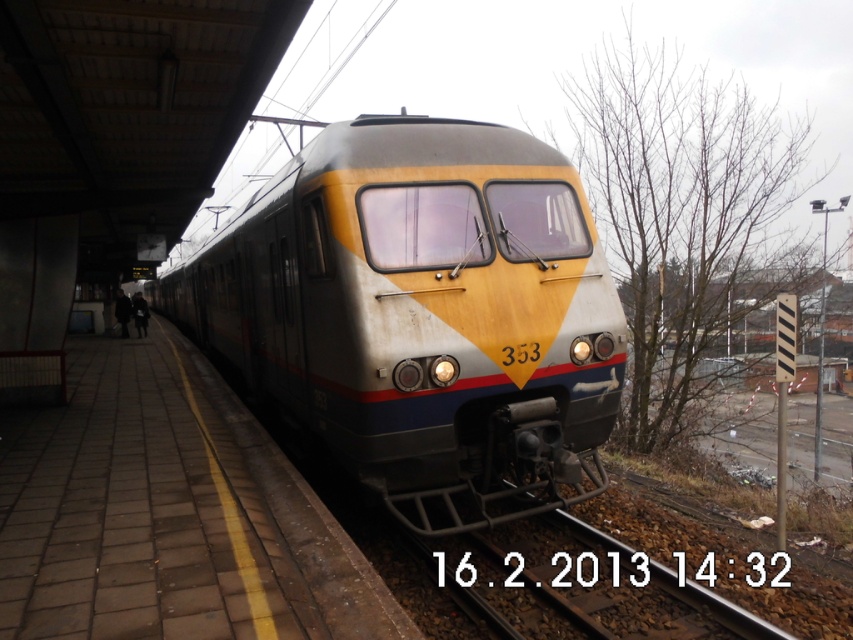
Can you confirm if matte gray train at center is bigger than brown gravel train track at lower center?

Yes, matte gray train at center is bigger than brown gravel train track at lower center.

Is point (397, 353) closer to viewer compared to point (654, 577)?

Yes, it is in front of point (654, 577).

This screenshot has height=640, width=853. What are the coordinates of `matte gray train at center` in the screenshot? It's located at (422, 314).